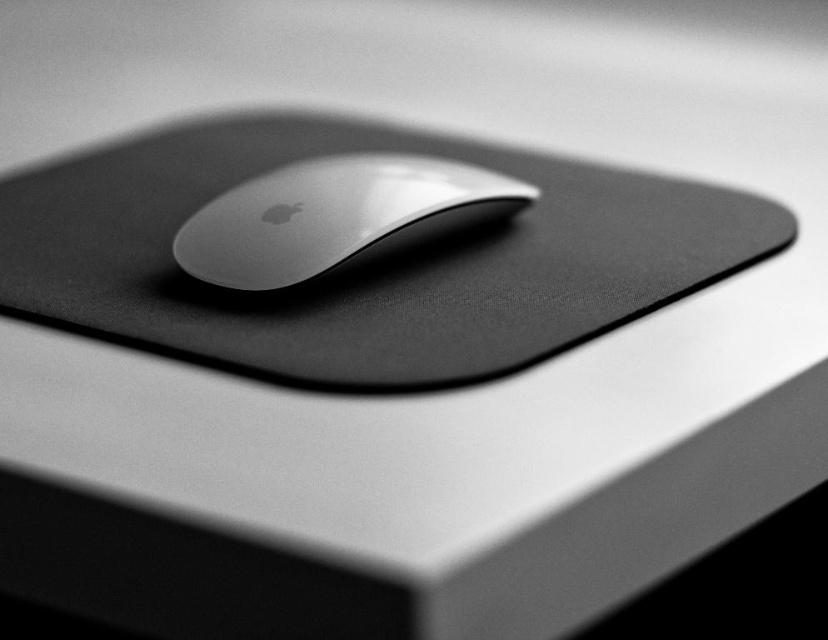
Is point (153, 180) positioned in front of point (439, 221)?

That is False.

You are a GUI agent. You are given a task and a screenshot of the screen. Output one action in this format:
    pyautogui.click(x=<x>, y=<y>)
    Task: Click on the black matte mousepad at center
    The width and height of the screenshot is (828, 640).
    Given the screenshot: What is the action you would take?
    pyautogui.click(x=367, y=260)